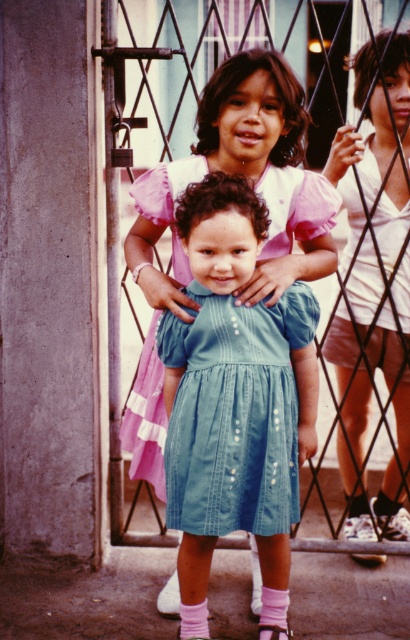
You are a photographer trying to capture a group photo of the denim dress at center and the white satin blouse at upper right. Considering their sizes, which one should you place closer to the camera to make them appear equally sized in the photo?

Since the denim dress at center is wider than the white satin blouse at upper right, you should place the white satin blouse at upper right closer to the camera to balance their apparent sizes in the photo.

You are a photographer trying to capture a group photo of the denim dress at center and the white satin blouse at upper right. Which one should you focus on first if you want to ensure both are in focus?

The denim dress at center has a lesser height compared to white satin blouse at upper right, so you should focus on the white satin blouse at upper right first to ensure both are in focus.

You are a photographer trying to capture a clear shot of the denim dress at center and the white satin blouse at upper right. Which one will appear larger in your photo?

The denim dress at center will appear larger in the photo because it is closer to the viewer than the white satin blouse at upper right.